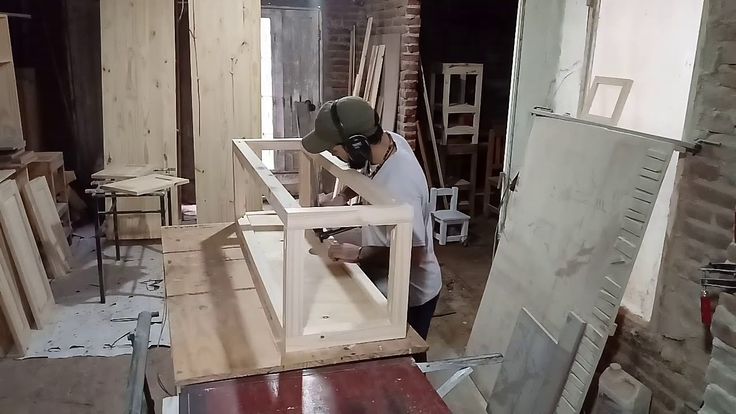
The width and height of the screenshot is (736, 414). In order to click on chair in this screenshot , I will do `click(488, 148)`, `click(453, 151)`, `click(450, 218)`.